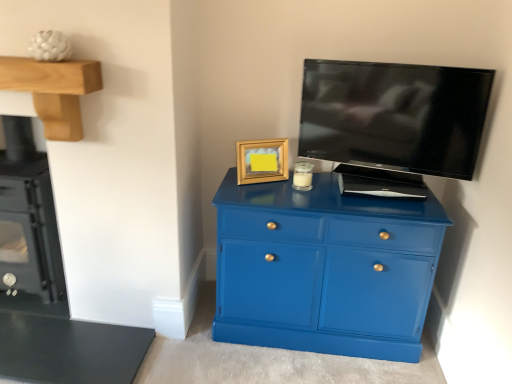
Locate an element on the screen. free space to the left of translucent glass candle at center is located at coordinates (274, 187).